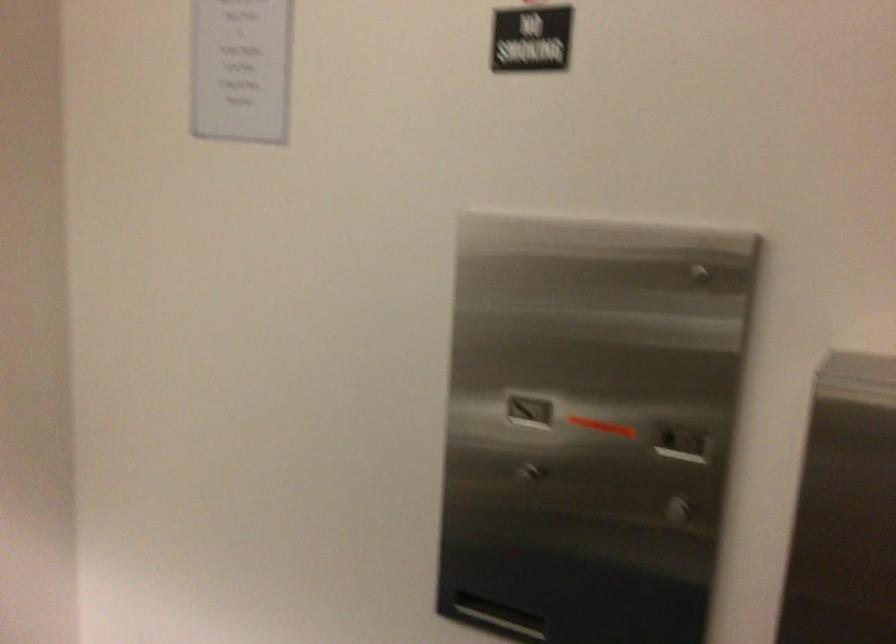
At what (x,y) coordinates should I click in order to perform the action: click on red dispenser lever. Please return your answer as a coordinate pair (x, y). The image size is (896, 644). Looking at the image, I should click on (600, 424).